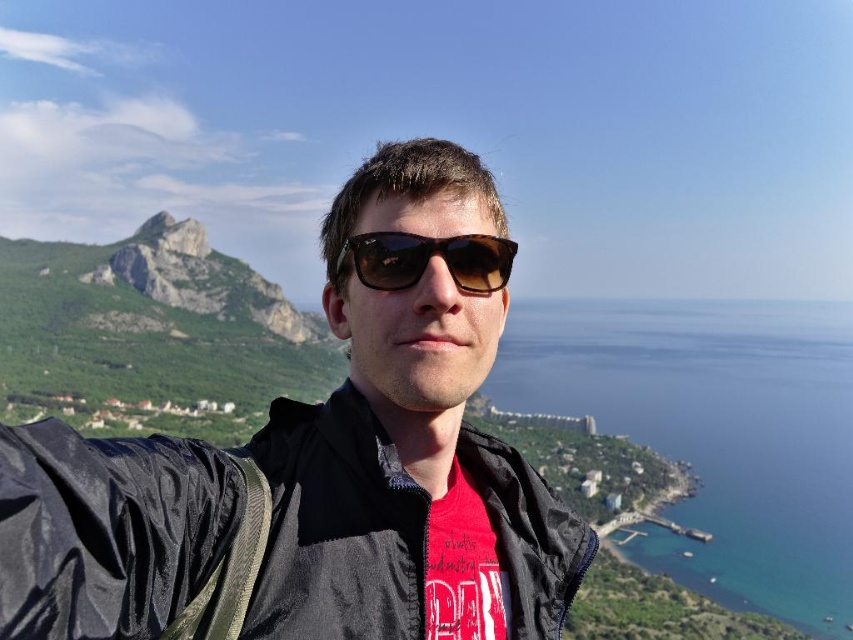
Does black matte jacket at center have a greater width compared to green rocky mountain at left?

No, black matte jacket at center is not wider than green rocky mountain at left.

Is black matte jacket at center smaller than green rocky mountain at left?

Correct, black matte jacket at center occupies less space than green rocky mountain at left.

Which is in front, point (148, 600) or point (165, 301)?

Point (148, 600) is in front.

Where is `black matte jacket at center`? black matte jacket at center is located at coordinates (106, 531).

Does black matte jacket at center have a smaller size compared to tortoiseshell sunglasses at center?

No.

Does black matte jacket at center lie in front of tortoiseshell sunglasses at center?

Yes, it is in front of tortoiseshell sunglasses at center.

Is point (51, 616) closer to viewer compared to point (422, 252)?

That is True.

Locate an element on the screen. This screenshot has width=853, height=640. black matte jacket at center is located at coordinates (106, 531).

Is green rocky mountain at left wider than tortoiseshell sunglasses at center?

Yes.

Which is below, green rocky mountain at left or tortoiseshell sunglasses at center?

green rocky mountain at left

At what (x,y) coordinates should I click in order to perform the action: click on green rocky mountain at left. Please return your answer as a coordinate pair (x, y). The height and width of the screenshot is (640, 853). Looking at the image, I should click on (154, 323).